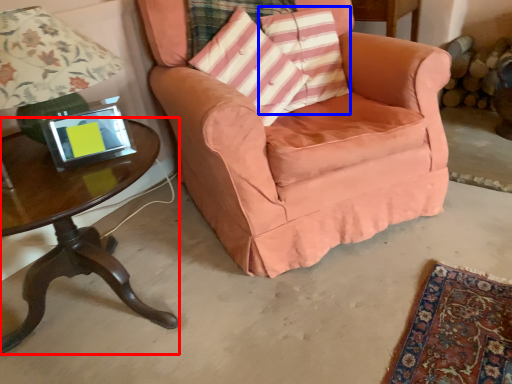
Question: Which point is further to the camera, table (highlighted by a red box) or pillow (highlighted by a blue box)?

Choices:
 (A) table
 (B) pillow

Answer: (B)